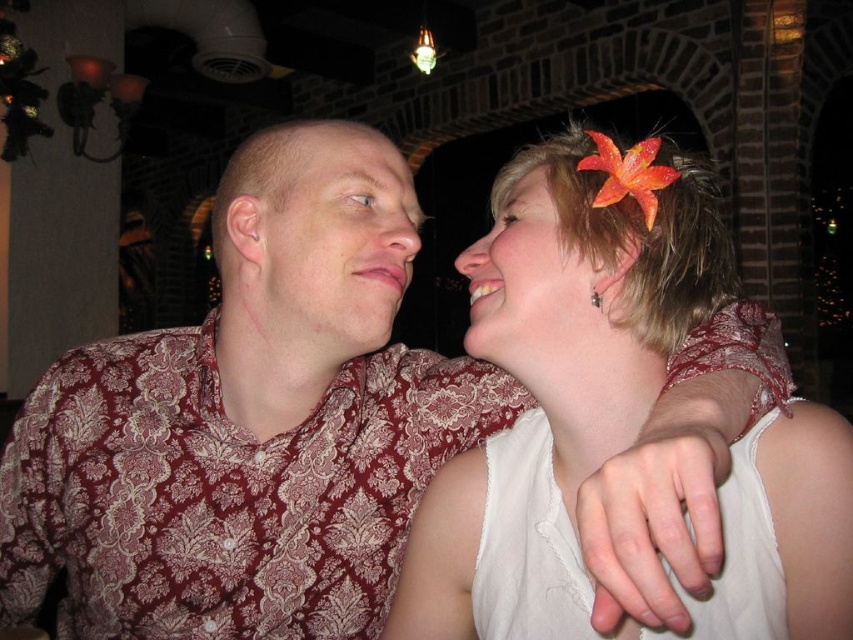
Measure the distance from white fabric flower at upper right to white matte flower at upper right.

white fabric flower at upper right and white matte flower at upper right are 9.34 centimeters apart.

Is point (781, 531) positioned behind point (508, 250)?

No, (781, 531) is closer to viewer.

Who is more forward, (x=508, y=236) or (x=463, y=272)?

Point (x=508, y=236) is more forward.

This screenshot has width=853, height=640. In order to click on white fabric flower at upper right in this screenshot , I will do `click(590, 294)`.

Is point (299, 308) closer to camera compared to point (558, 317)?

No, (299, 308) is further to viewer.

Which of these two, matte floral shirt at left or white matte flower at upper right, stands taller?

Standing taller between the two is matte floral shirt at left.

Between point (312, 260) and point (556, 252), which one is positioned in front?

Point (556, 252) is in front.

Where is `matte floral shirt at left`? The height and width of the screenshot is (640, 853). matte floral shirt at left is located at coordinates (332, 241).

Where is `matte floral shirt at left`? matte floral shirt at left is located at coordinates (332, 241).

Which is in front, point (328, 170) or point (412, 173)?

Point (328, 170) is more forward.

Where is `matte floral shirt at left`? The width and height of the screenshot is (853, 640). matte floral shirt at left is located at coordinates (332, 241).